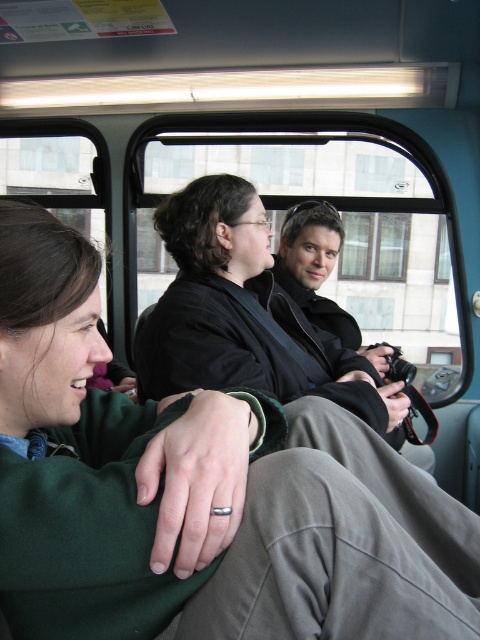
Is green soft sweater at center above matte black camera at center?

No.

The width and height of the screenshot is (480, 640). Find the location of `green soft sweater at center`. green soft sweater at center is located at coordinates (196, 492).

The image size is (480, 640). What do you see at coordinates (196, 492) in the screenshot?
I see `green soft sweater at center` at bounding box center [196, 492].

This screenshot has height=640, width=480. I want to click on green soft sweater at center, so click(196, 492).